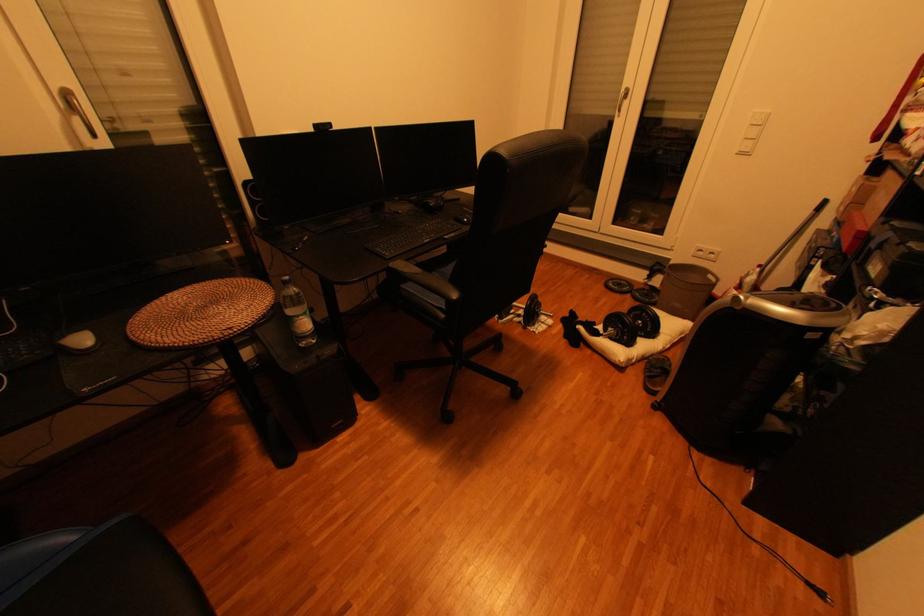
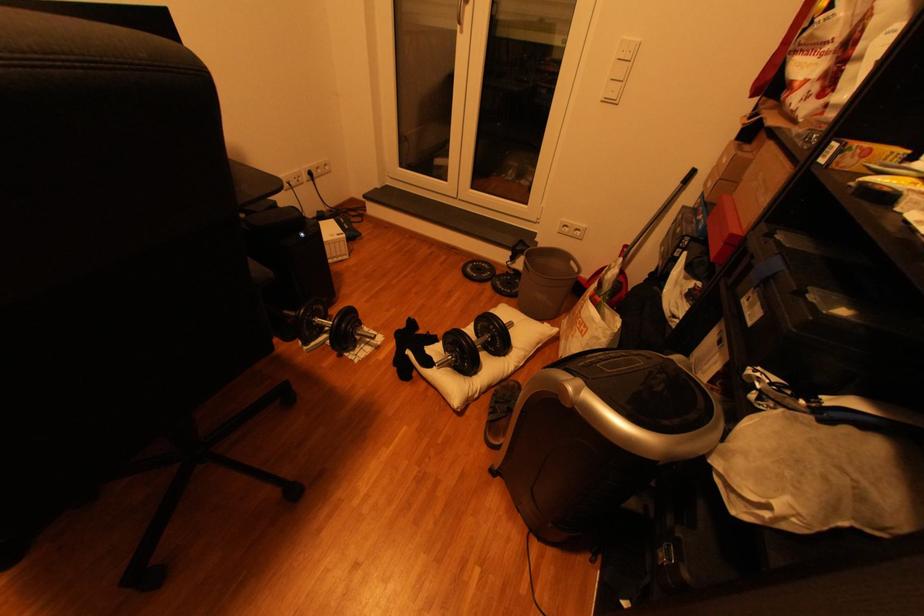
The point at (623, 285) is marked in the first image. Where is the corresponding point in the second image?

(482, 270)